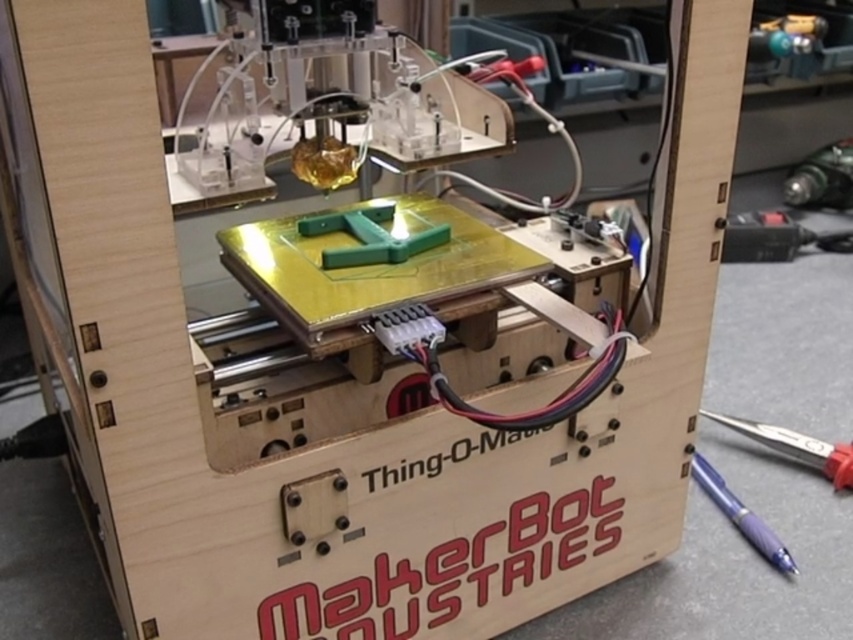
Question: Which point appears closest to the camera in this image?

Choices:
 (A) (381, 204)
 (B) (850, 461)
 (C) (788, 570)

Answer: (A)

Question: Which object appears closest to the camera in this image?

Choices:
 (A) metallic blue pen at lower right
 (B) green matte plastic at center

Answer: (B)

Question: Is green matte plastic at center bigger than metallic blue pen at lower right?

Choices:
 (A) no
 (B) yes

Answer: (A)

Question: Does green matte plastic at center have a smaller size compared to metallic blue pen at lower right?

Choices:
 (A) no
 (B) yes

Answer: (B)

Question: Which of the following is the closest to the observer?

Choices:
 (A) green matte plastic at center
 (B) metallic blue pen at lower right
 (C) purple glossy pen at lower right

Answer: (A)

Question: Does green matte plastic at center appear on the right side of purple glossy pen at lower right?

Choices:
 (A) yes
 (B) no

Answer: (B)